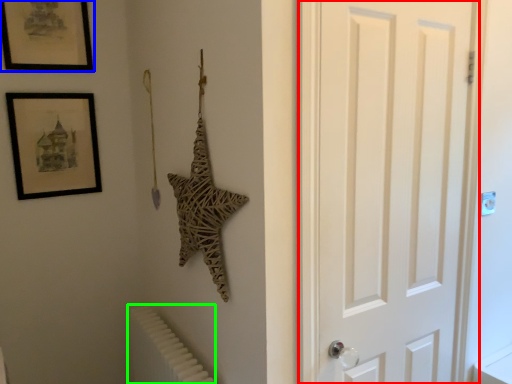
Question: Estimate the real-world distances between objects in this image. Which object is closer to door (highlighted by a red box), picture frame (highlighted by a blue box) or radiator (highlighted by a green box)?

Choices:
 (A) picture frame
 (B) radiator

Answer: (B)